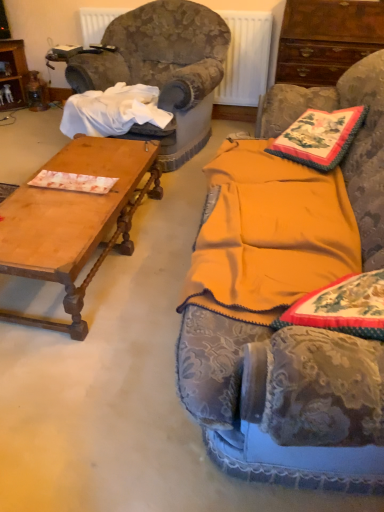
Locate an element on the screen. The image size is (384, 512). free location in front of wooden polished coffee table at left is located at coordinates (100, 377).